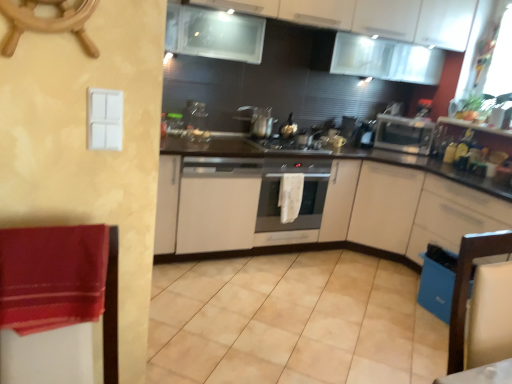
Question: Is satin silver oven at center to the left of white matte cabinet at center, marked as the 2th cabinetry in a bottom-to-top arrangement, from the viewer's perspective?

Choices:
 (A) yes
 (B) no

Answer: (B)

Question: Is satin silver oven at center further to camera compared to white matte cabinet at center, marked as the 2th cabinetry in a bottom-to-top arrangement?

Choices:
 (A) no
 (B) yes

Answer: (B)

Question: Is there a large distance between satin silver oven at center and white matte cabinet at center, marked as the 2th cabinetry in a bottom-to-top arrangement?

Choices:
 (A) yes
 (B) no

Answer: (B)

Question: From the image's perspective, is satin silver oven at center below white matte cabinet at center, marked as the 2th cabinetry in a bottom-to-top arrangement?

Choices:
 (A) yes
 (B) no

Answer: (B)

Question: Is satin silver oven at center looking in the opposite direction of white matte cabinet at center, which ranks as the 3th cabinetry in top-to-bottom order?

Choices:
 (A) no
 (B) yes

Answer: (B)

Question: Is satin silver oven at center smaller than white matte cabinet at center, marked as the 2th cabinetry in a bottom-to-top arrangement?

Choices:
 (A) yes
 (B) no

Answer: (A)

Question: Is velvet red blanket at left facing towards white glossy cabinets at upper center, which is counted as the 4th cabinetry, starting from the bottom?

Choices:
 (A) no
 (B) yes

Answer: (A)

Question: Is velvet red blanket at left positioned with its back to white glossy cabinets at upper center, which is the first cabinetry from top to bottom?

Choices:
 (A) no
 (B) yes

Answer: (A)

Question: Is the depth of velvet red blanket at left greater than that of white glossy cabinets at upper center, which is counted as the 4th cabinetry, starting from the bottom?

Choices:
 (A) yes
 (B) no

Answer: (B)

Question: Considering the relative sizes of velvet red blanket at left and white glossy cabinets at upper center, which is counted as the 4th cabinetry, starting from the bottom, in the image provided, is velvet red blanket at left taller than white glossy cabinets at upper center, which is counted as the 4th cabinetry, starting from the bottom,?

Choices:
 (A) no
 (B) yes

Answer: (A)

Question: Is velvet red blanket at left wider than white glossy cabinets at upper center, which is counted as the 4th cabinetry, starting from the bottom?

Choices:
 (A) yes
 (B) no

Answer: (B)

Question: From the image's perspective, is velvet red blanket at left located above white glossy cabinets at upper center, which is the first cabinetry from top to bottom?

Choices:
 (A) no
 (B) yes

Answer: (A)

Question: Is wooden chair at lower right to the right of white matte cabinet at center, positioned as the first cabinetry in bottom-to-top order, from the viewer's perspective?

Choices:
 (A) yes
 (B) no

Answer: (B)